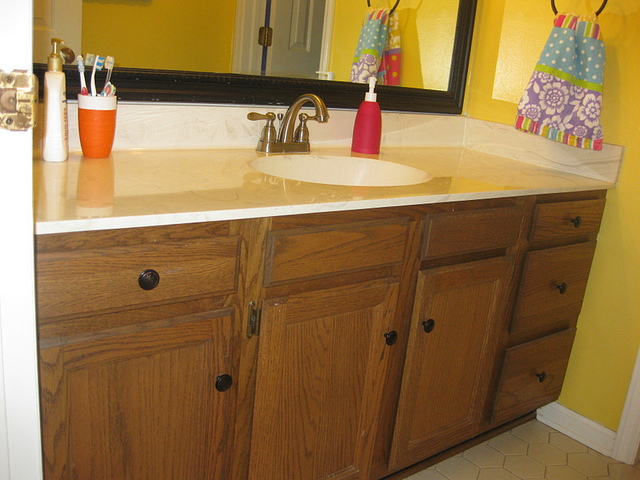
At what (x,y) coordinates should I click in order to perform the action: click on drawer. Please return your answer as a coordinate pair (x, y). The height and width of the screenshot is (480, 640). Looking at the image, I should click on coord(545,297).